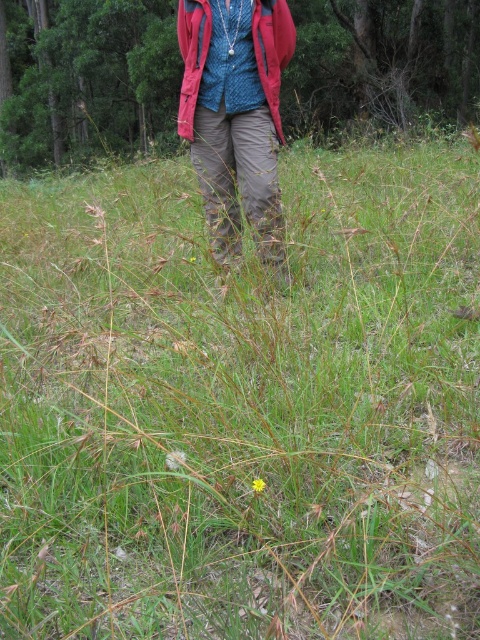
You are a photographer trying to capture the knitted blue sweater at center and the red fleece jacket at center in the same frame. Since both are at the center, where should you position your camera to ensure both are visible?

→ The knitted blue sweater at center is to the right of the red fleece jacket at center. Position the camera slightly to the left of the red fleece jacket at center so that the knitted blue sweater at center is on the right side of the frame, ensuring both are visible in the shot.

You are a hiker who wants to check the weather forecast on your phone. You remember you placed your phone in either the knitted blue sweater at center or the red fleece jacket at center. Which clothing item should you check first based on their positions?

The knitted blue sweater at center is below the red fleece jacket at center, so you should check the red fleece jacket at center first as it is positioned above.

From the picture: You are a photographer trying to capture the khaki pants at center and the red fleece jacket at center in the same frame. Based on their positions, which object should you adjust your camera to focus on first if you want to include both in your shot?

The khaki pants at center is to the right of the red fleece jacket at center, so you should focus on the red fleece jacket at center first to ensure both are in the frame.